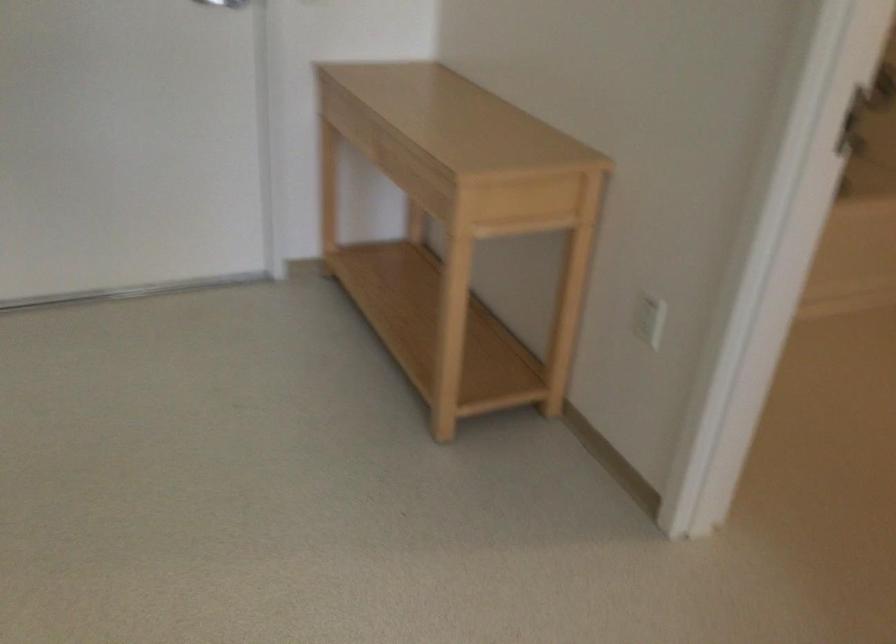
What do you see at coordinates (236, 5) in the screenshot? This screenshot has width=896, height=644. I see `the silver door handle` at bounding box center [236, 5].